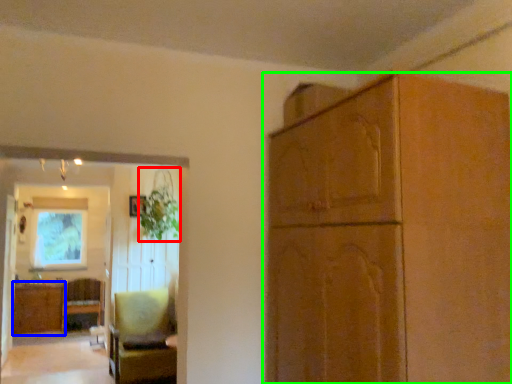
Question: Which object is positioned farthest from plant (highlighted by a red box)? Select from cabinetry (highlighted by a blue box) and cabinetry (highlighted by a green box).

Choices:
 (A) cabinetry
 (B) cabinetry

Answer: (B)